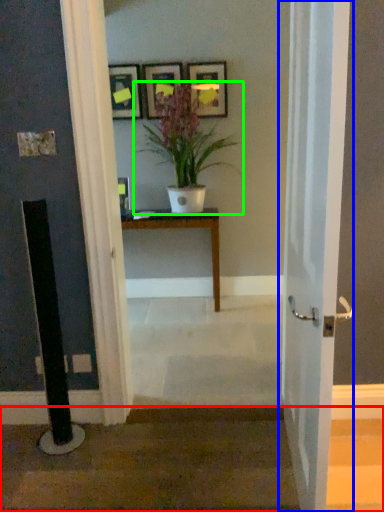
Question: Based on their relative distances, which object is farther from stairwell (highlighted by a red box)? Choose from door (highlighted by a blue box) and houseplant (highlighted by a green box).

Choices:
 (A) door
 (B) houseplant

Answer: (B)